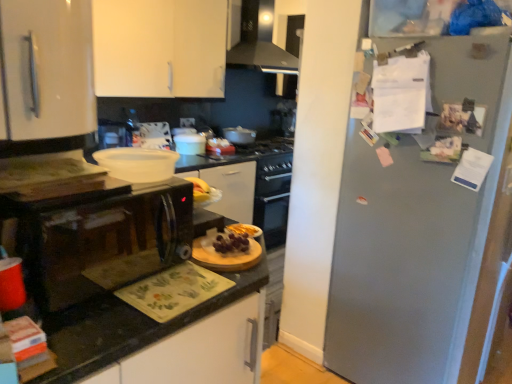
Question: From a real-world perspective, is white matte cabinet at upper left on top of matte white pot at center, the second appliance in the left-to-right sequence?

Choices:
 (A) yes
 (B) no

Answer: (A)

Question: Could you tell me if white matte cabinet at upper left is turned towards matte white pot at center, which is the second appliance from back to front?

Choices:
 (A) no
 (B) yes

Answer: (A)

Question: From a real-world perspective, is white matte cabinet at upper left under matte white pot at center, which is the second appliance from back to front?

Choices:
 (A) yes
 (B) no

Answer: (B)

Question: Considering the relative positions of white matte cabinet at upper left and matte white pot at center, marked as the 2th appliance in a right-to-left arrangement, in the image provided, is white matte cabinet at upper left to the left of matte white pot at center, marked as the 2th appliance in a right-to-left arrangement, from the viewer's perspective?

Choices:
 (A) no
 (B) yes

Answer: (B)

Question: Considering the relative sizes of white matte cabinet at upper left and matte white pot at center, marked as the 2th appliance in a right-to-left arrangement, in the image provided, is white matte cabinet at upper left shorter than matte white pot at center, marked as the 2th appliance in a right-to-left arrangement,?

Choices:
 (A) yes
 (B) no

Answer: (B)

Question: Considering the positions of point (265, 34) and point (291, 104), is point (265, 34) closer or farther from the camera than point (291, 104)?

Choices:
 (A) farther
 (B) closer

Answer: (B)

Question: In terms of height, does metallic silver range hood at upper center look taller or shorter compared to satin silver kettle at upper center, the first appliance when ordered from back to front?

Choices:
 (A) tall
 (B) short

Answer: (A)

Question: Would you say metallic silver range hood at upper center is to the left or to the right of satin silver kettle at upper center, the third appliance when ordered from left to right, in the picture?

Choices:
 (A) left
 (B) right

Answer: (A)

Question: Which is correct: metallic silver range hood at upper center is inside satin silver kettle at upper center, the first appliance when ordered from back to front, or outside of it?

Choices:
 (A) inside
 (B) outside

Answer: (B)

Question: Considering the positions of point (198, 195) and point (245, 243), is point (198, 195) closer or farther from the camera than point (245, 243)?

Choices:
 (A) closer
 (B) farther

Answer: (B)

Question: From the image's perspective, is yellow matte bananas at center, arranged as the 1th food when viewed from the top, positioned above or below slightly glossy wooden cutting board at center, the 2th food viewed from the top?

Choices:
 (A) below
 (B) above

Answer: (B)

Question: Is yellow matte bananas at center, arranged as the second food when viewed from the front, wider or thinner than slightly glossy wooden cutting board at center, arranged as the 2th food when viewed from the left?

Choices:
 (A) thin
 (B) wide

Answer: (B)

Question: Considering their positions, is yellow matte bananas at center, the first food in the left-to-right sequence, located in front of or behind slightly glossy wooden cutting board at center, the 1th food viewed from the right?

Choices:
 (A) front
 (B) behind

Answer: (B)

Question: From their relative heights in the image, would you say metallic gray refrigerator at right is taller or shorter than black granite countertop at center?

Choices:
 (A) tall
 (B) short

Answer: (A)

Question: Based on their positions, is metallic gray refrigerator at right located to the left or right of black granite countertop at center?

Choices:
 (A) right
 (B) left

Answer: (A)